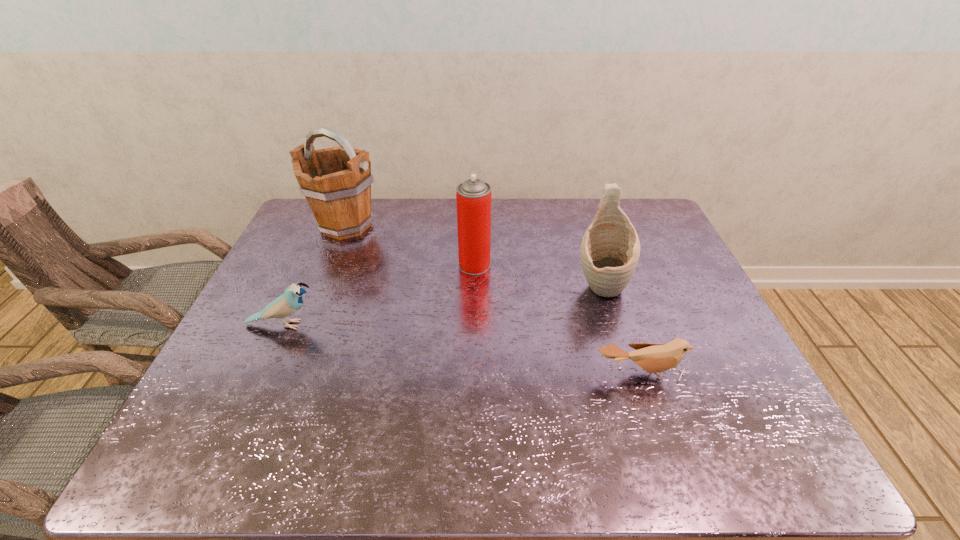
The image size is (960, 540). What are the coordinates of `bucket` in the screenshot? It's located at (336, 182).

Where is `pitcher`? The height and width of the screenshot is (540, 960). pitcher is located at coordinates [610, 248].

Where is `the third object from left to right`? The height and width of the screenshot is (540, 960). the third object from left to right is located at coordinates (473, 197).

Image resolution: width=960 pixels, height=540 pixels. I want to click on the farther bird, so click(x=291, y=301).

You are a GUI agent. You are given a task and a screenshot of the screen. Output one action in this format:
    pyautogui.click(x=<x>, y=<y>)
    Task: Click on the left bird
    
    Given the screenshot: What is the action you would take?
    pyautogui.click(x=291, y=301)

At what (x,y) coordinates should I click in order to perform the action: click on the shorter bird. Please return your answer as a coordinate pair (x, y). Looking at the image, I should click on (653, 358).

The image size is (960, 540). I want to click on the nearest object, so pyautogui.click(x=653, y=358).

Where is `blank space located 0.190m on the front of the farthest object`? This screenshot has height=540, width=960. blank space located 0.190m on the front of the farthest object is located at coordinates (322, 286).

This screenshot has width=960, height=540. What are the coordinates of `vacant space located at the spout of the pitcher` in the screenshot? It's located at (626, 373).

Locate an element on the screen. This screenshot has height=540, width=960. vacant region located 0.070m on the back of the aerosol can is located at coordinates (475, 242).